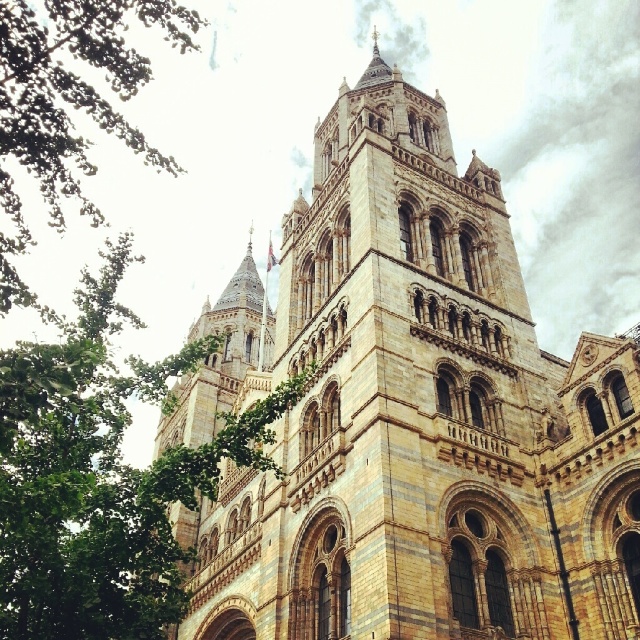
Question: Is brown stone church at center positioned behind green leafy tree at upper left?

Choices:
 (A) no
 (B) yes

Answer: (B)

Question: Which point is farther from the camera taking this photo?

Choices:
 (A) [x=244, y=352]
 (B) [x=48, y=156]

Answer: (A)

Question: Which object is positioned farthest from the brown stone church at center?

Choices:
 (A) green leafy tree at left
 (B) green leafy tree at upper left

Answer: (B)

Question: Is green leafy tree at left to the left of green leafy tree at upper left from the viewer's perspective?

Choices:
 (A) no
 (B) yes

Answer: (A)

Question: Which is farther from the green leafy tree at left?

Choices:
 (A) green leafy tree at upper left
 (B) brown stone church at center

Answer: (A)

Question: Is brown stone church at center to the right of green leafy tree at upper left from the viewer's perspective?

Choices:
 (A) no
 (B) yes

Answer: (B)